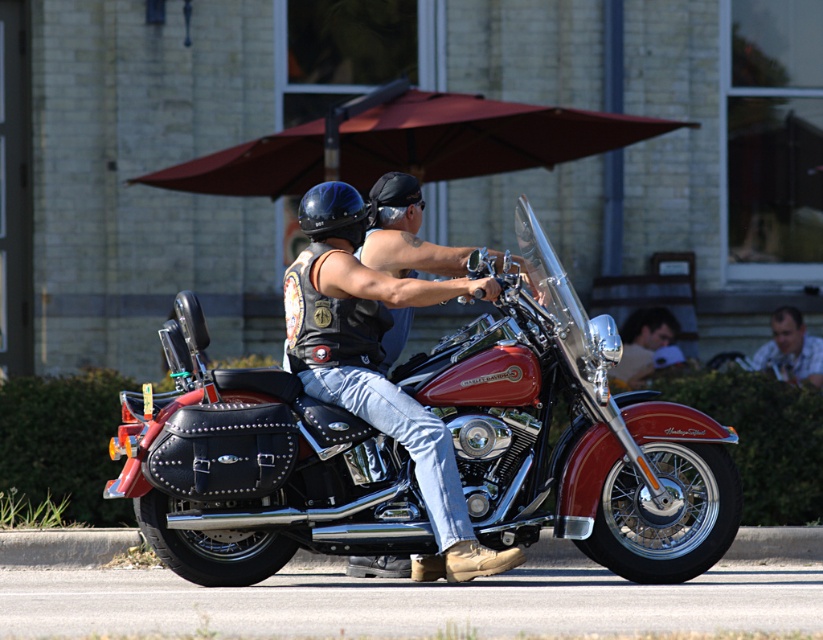
Question: Is maroon fabric umbrella at upper center to the left of blue denim jeans at center from the viewer's perspective?

Choices:
 (A) no
 (B) yes

Answer: (B)

Question: Estimate the real-world distances between objects in this image. Which object is farther from the leather/vintage vest at center?

Choices:
 (A) maroon fabric umbrella at upper center
 (B) blue denim jeans at center

Answer: (B)

Question: Which point is farther from the camera taking this photo?

Choices:
 (A) (221, 168)
 (B) (801, 324)

Answer: (B)

Question: Which of the following is the closest to the observer?

Choices:
 (A) (370, 216)
 (B) (568, 515)

Answer: (B)

Question: Is matte black vest at center to the right of denim jacket at center from the viewer's perspective?

Choices:
 (A) yes
 (B) no

Answer: (B)

Question: Where is maroon fabric umbrella at upper center located in relation to blue denim jeans at center in the image?

Choices:
 (A) left
 (B) right

Answer: (A)